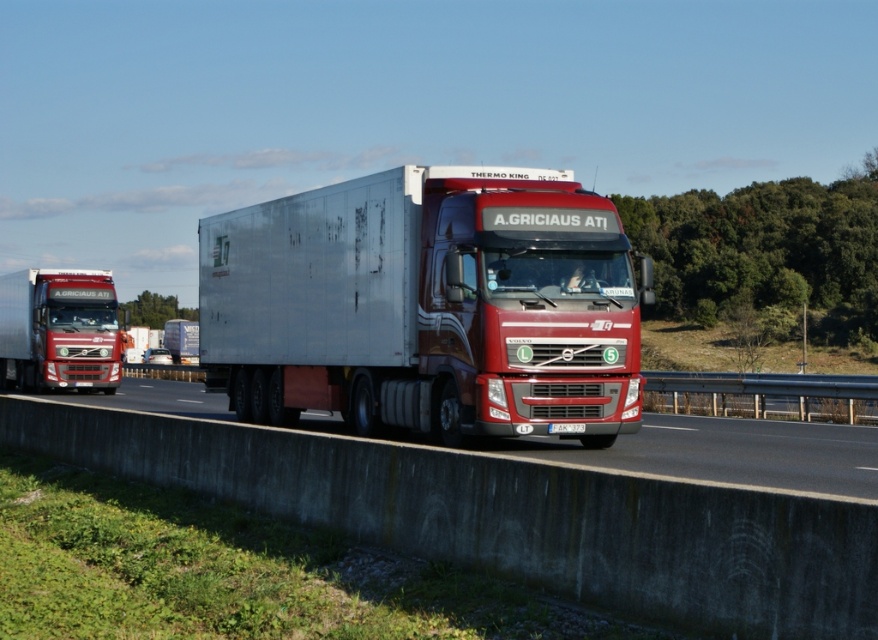
You are a delivery driver who needs to pass through a narrow tunnel that can only accommodate vehicles up to the size of the metallic concrete barrier at center. Can the silver metallic trailer truck at center safely pass through the tunnel?

The silver metallic trailer truck at center is smaller than the metallic concrete barrier at center, so it can safely pass through the tunnel.

You are a delivery driver who needs to pass under a bridge that has a height restriction of 4 meters. You are driving the silver metallic trailer truck at center. There is a metallic concrete barrier at center in your path. Can you safely pass under the bridge without hitting the barrier?

The silver metallic trailer truck at center has a greater height compared to the metallic concrete barrier at center. Since the truck is taller than the barrier, you can safely pass under the bridge as long as the bridge itself allows the truck to pass. However, the height restriction of the bridge must be considered separately to ensure the truck can pass without hitting the bridge structure.